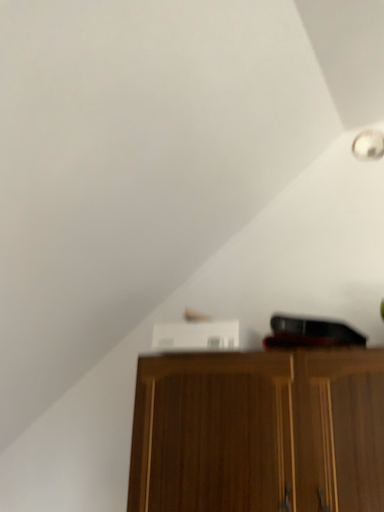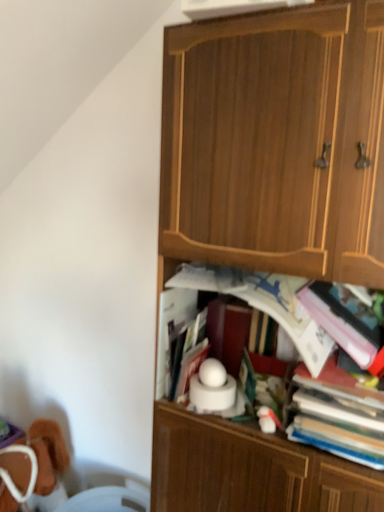
Question: How did the camera likely rotate when shooting the video?

Choices:
 (A) rotated upward
 (B) rotated downward

Answer: (B)